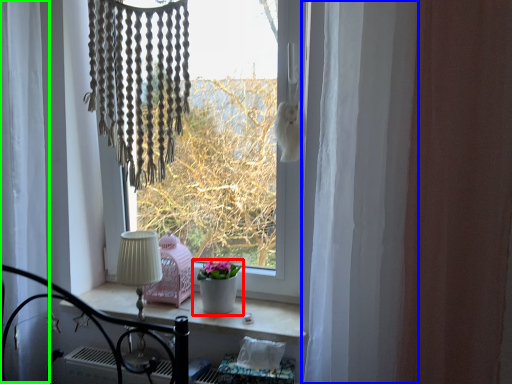
Question: Considering the real-world distances, which object is closest to houseplant (highlighted by a red box)? curtain (highlighted by a blue box) or curtain (highlighted by a green box).

Choices:
 (A) curtain
 (B) curtain

Answer: (A)